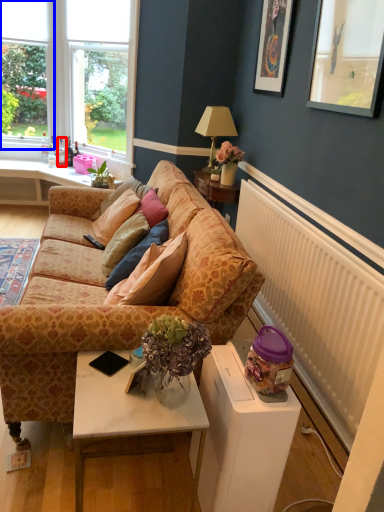
Question: Which of the following is the farthest to the observer, bottle (highlighted by a red box) or window frame (highlighted by a blue box)?

Choices:
 (A) bottle
 (B) window frame

Answer: (A)